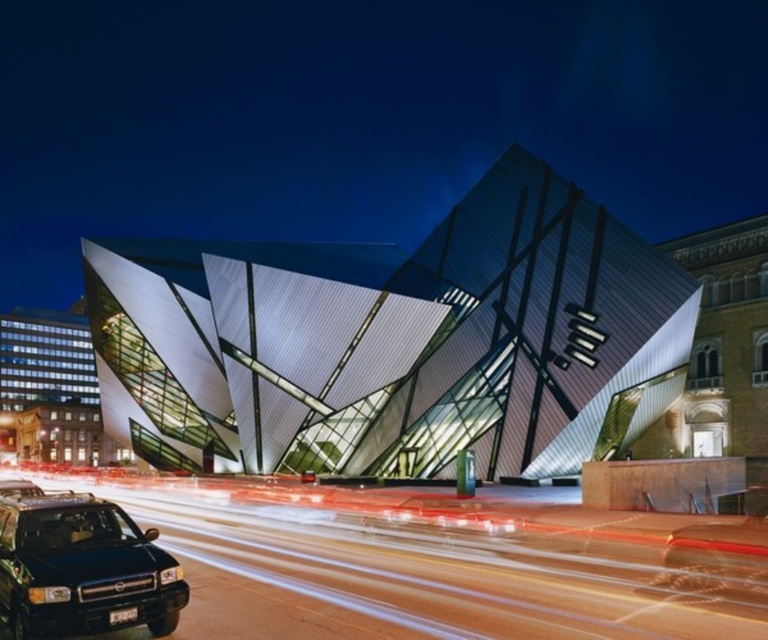
Identify the location of polished glass building at center. Image resolution: width=768 pixels, height=640 pixels. (394, 340).

Between polished glass building at center and black matte suv at lower left, which one is positioned lower?

black matte suv at lower left

Which is behind, point (604, 220) or point (28, 556)?

The point (604, 220) is more distant.

This screenshot has width=768, height=640. In order to click on polished glass building at center in this screenshot , I will do `click(394, 340)`.